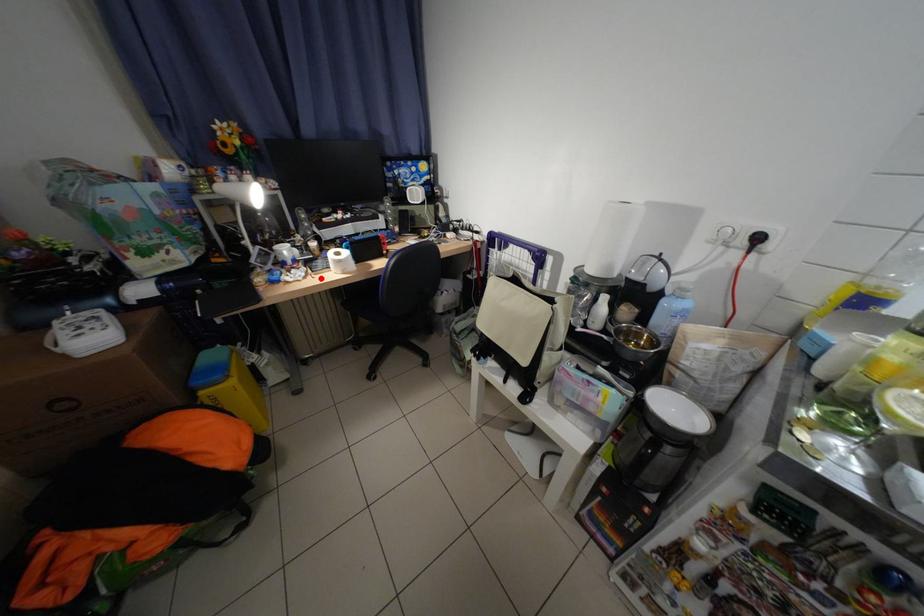
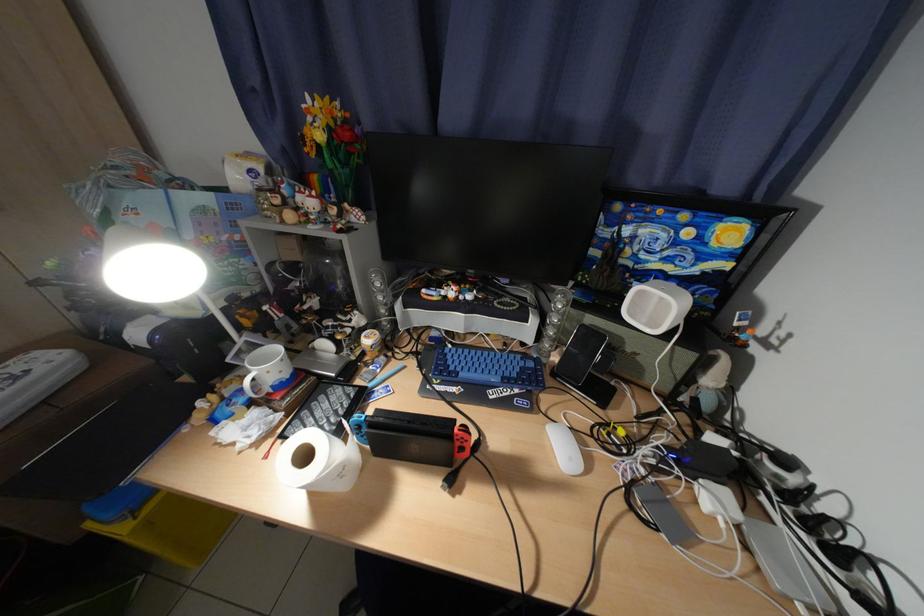
The point at the highlighted location is marked in the first image. Where is the corresponding point in the second image?

(282, 444)